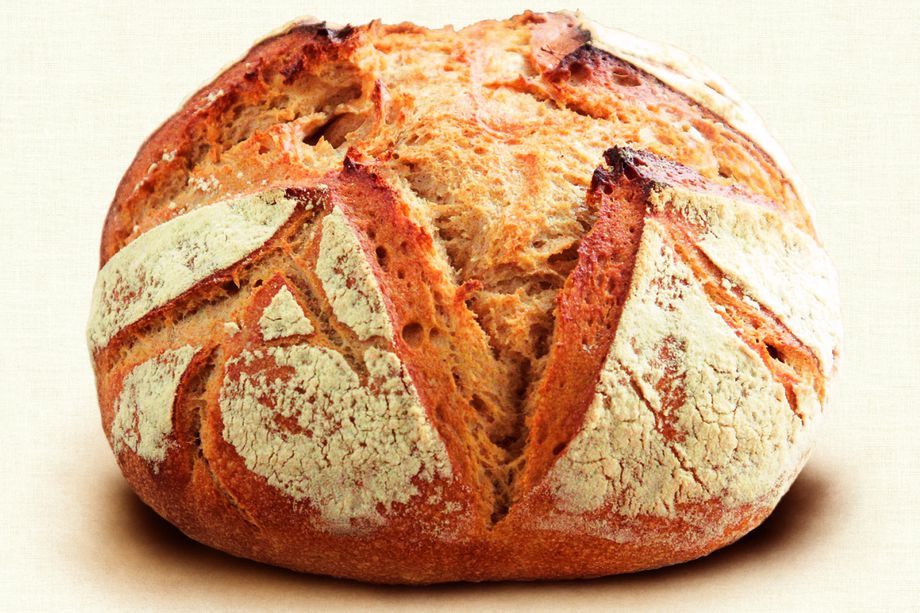
Where is `counter top`? The width and height of the screenshot is (920, 613). counter top is located at coordinates (836, 587).